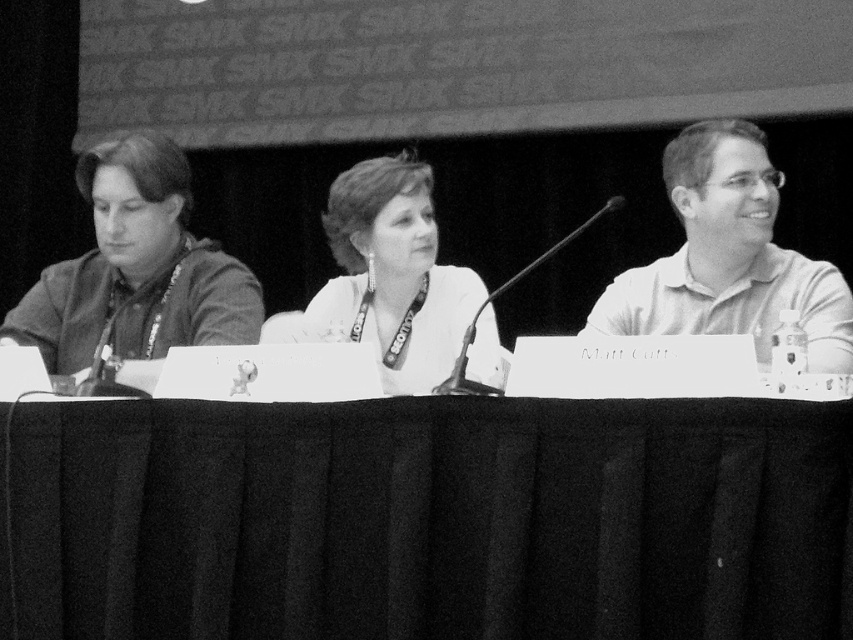
From the picture: Based on the scene described, what object is located at the coordinates point (432, 518)?

The black fabric table at center is located at point (432, 518).